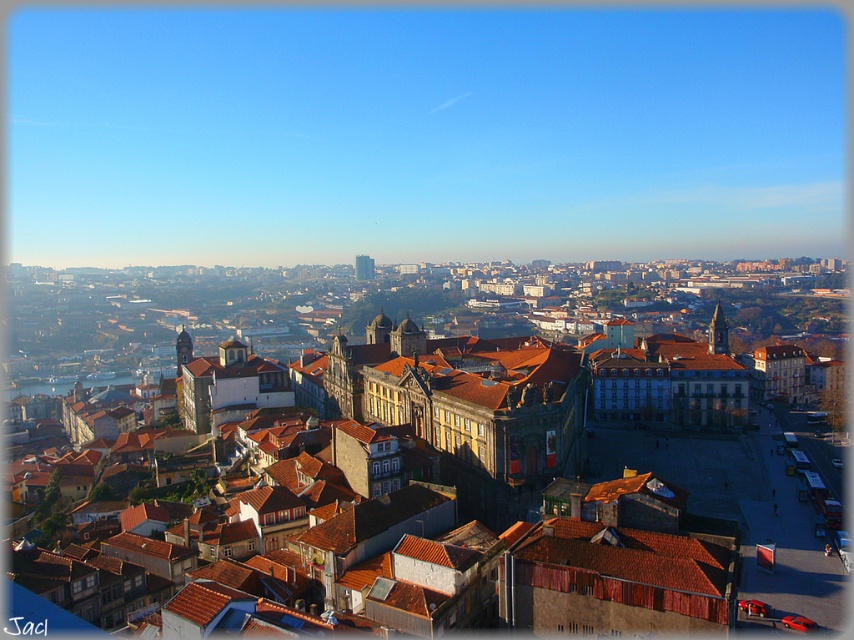
Question: Which of these objects is positioned closest to the matte stone tower at center?

Choices:
 (A) smooth stone tower at center
 (B) brown stone tower at center

Answer: (B)

Question: Which of these objects is positioned farthest from the brown stone tower at center?

Choices:
 (A) matte stone tower at center
 (B) smooth stone tower at center

Answer: (B)

Question: Is the position of matte stone tower at center less distant than that of smooth stone tower at center?

Choices:
 (A) yes
 (B) no

Answer: (A)

Question: Is brown stone tower at center bigger than smooth stone tower at center?

Choices:
 (A) no
 (B) yes

Answer: (B)

Question: Is brown stone tower at center thinner than matte stone tower at center?

Choices:
 (A) no
 (B) yes

Answer: (A)

Question: Which object appears farthest from the camera in this image?

Choices:
 (A) smooth stone tower at center
 (B) brown stone tower at center

Answer: (A)